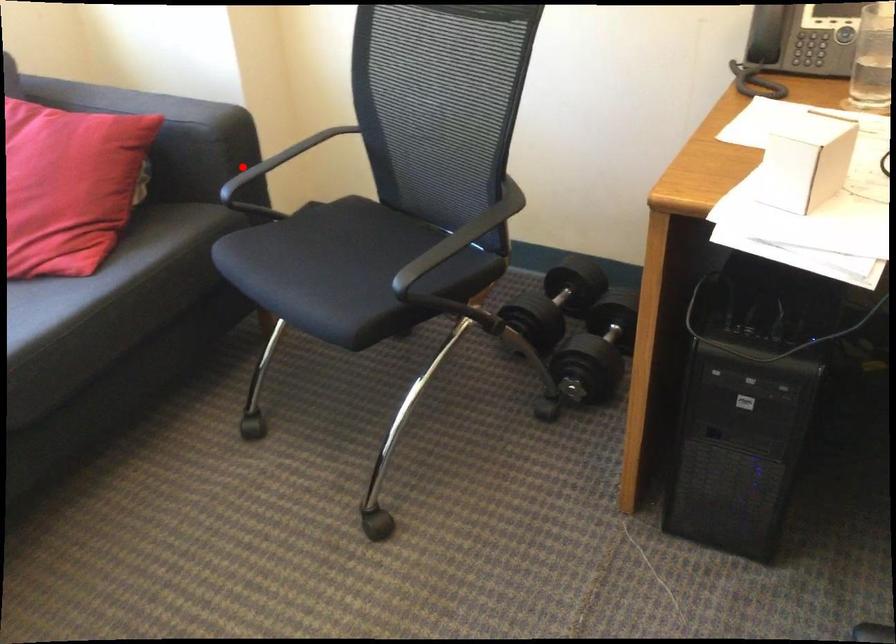
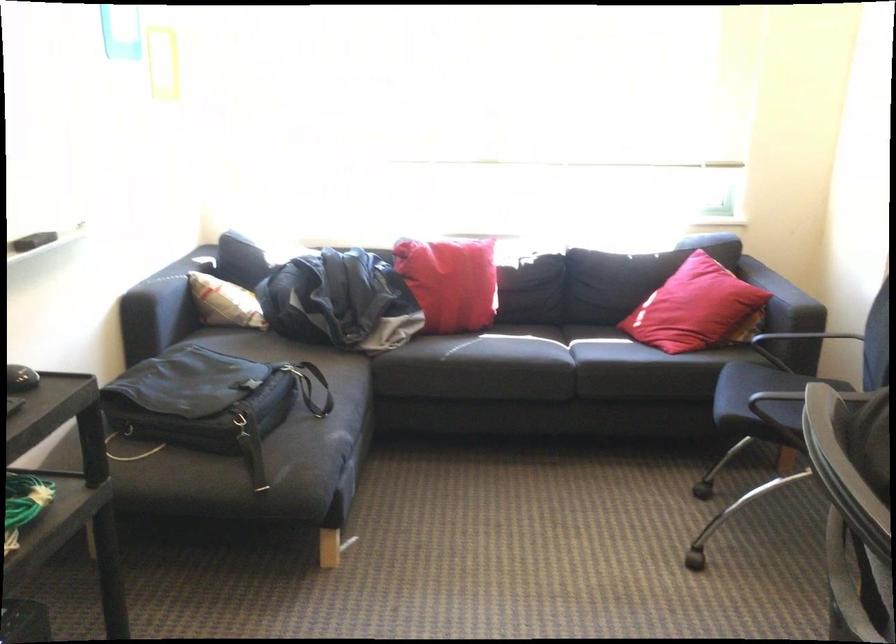
The point at the highlighted location is marked in the first image. Where is the corresponding point in the second image?

(802, 337)